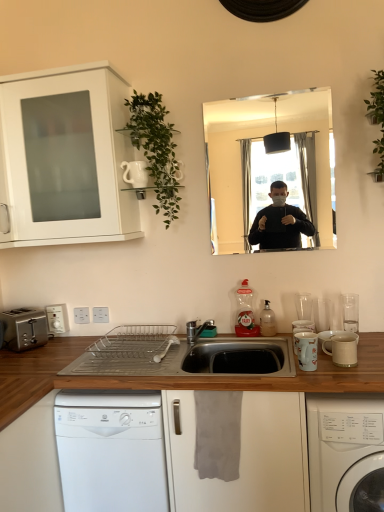
Locate an element on the screen. This screenshot has width=384, height=512. free region on the left part of translucent plastic bottle at sink, the second bottle when ordered from right to left is located at coordinates (219, 339).